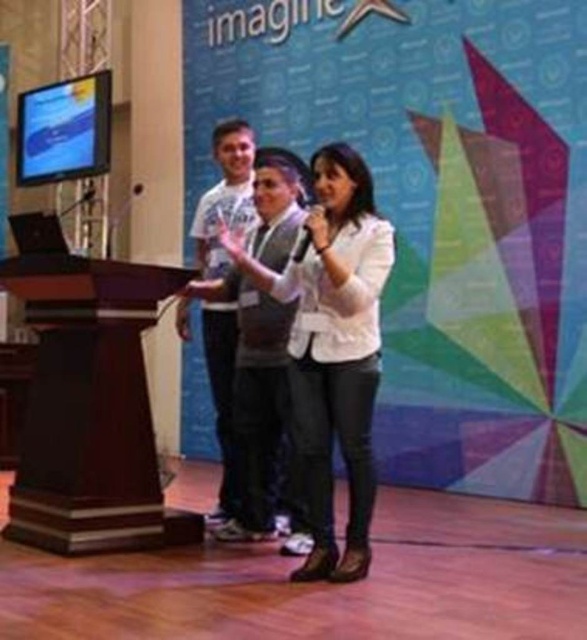
Question: Estimate the real-world distances between objects in this image. Which object is closer to the dark wood podium at left?

Choices:
 (A) white cotton t-shirt at center
 (B) metallic silver microphone at center

Answer: (A)

Question: Is dark wood podium at left above white matte jacket at center?

Choices:
 (A) yes
 (B) no

Answer: (B)

Question: Is dark wood podium at left wider than metallic silver microphone at center?

Choices:
 (A) yes
 (B) no

Answer: (A)

Question: Which of the following is the closest to the observer?

Choices:
 (A) (291, 253)
 (B) (86, 504)

Answer: (A)

Question: From the image, what is the correct spatial relationship of white matte jacket at center in relation to white cotton t-shirt at center?

Choices:
 (A) below
 (B) above

Answer: (A)

Question: Considering the real-world distances, which object is closest to the dark wood podium at left?

Choices:
 (A) white cotton t-shirt at center
 (B) white matte jacket at center
 (C) metallic silver microphone at center

Answer: (A)